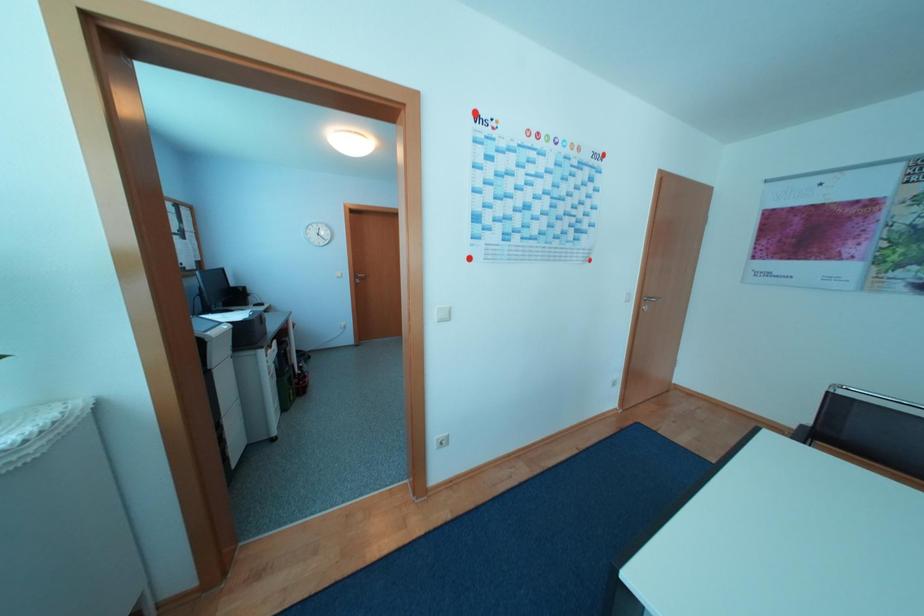
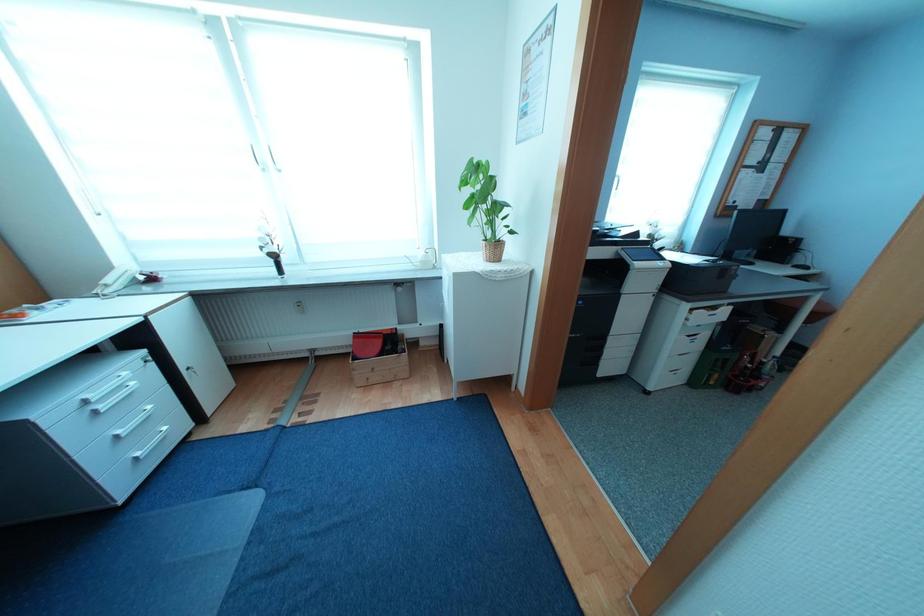
First-person continuous shooting, in which direction is the camera rotating?

The rotation direction of the camera is left-down.